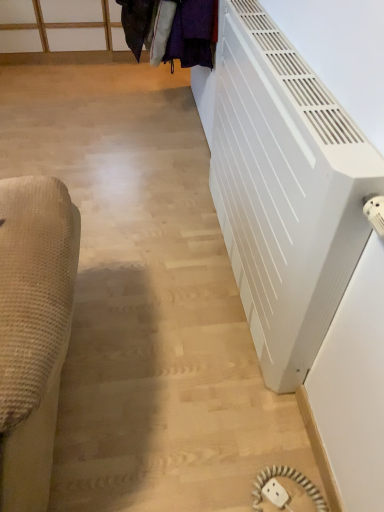
This screenshot has height=512, width=384. Find the location of `vacant area on top of white matte radiator at right (from a real-world perspective)`. vacant area on top of white matte radiator at right (from a real-world perspective) is located at coordinates (297, 67).